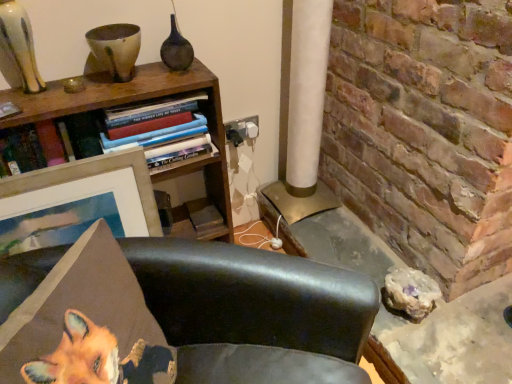
Where is `vacant space in front of white paper lampshade at center`? The width and height of the screenshot is (512, 384). vacant space in front of white paper lampshade at center is located at coordinates (329, 240).